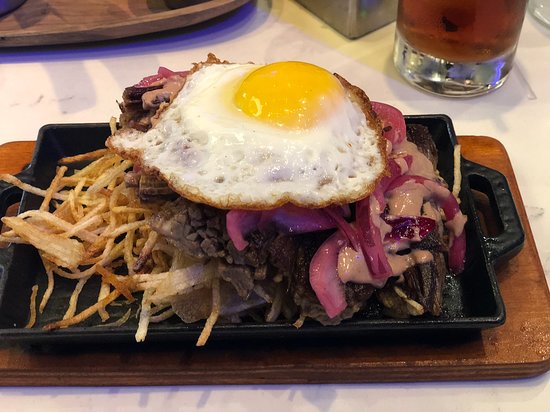
What are the coordinates of `skillet` in the screenshot? It's located at (51, 335).